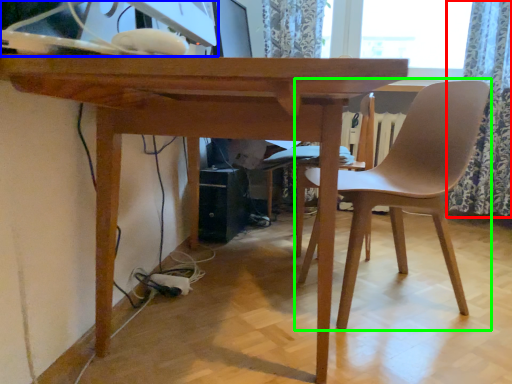
Question: Which object is the farthest from curtain (highlighted by a red box)? Choose among these: desktop computer (highlighted by a blue box) or chair (highlighted by a green box).

Choices:
 (A) desktop computer
 (B) chair

Answer: (A)